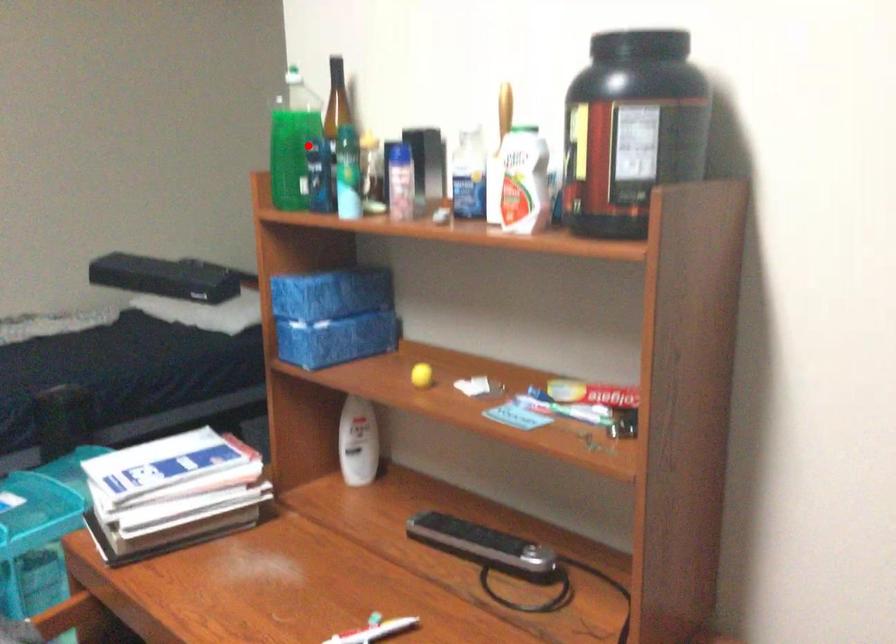
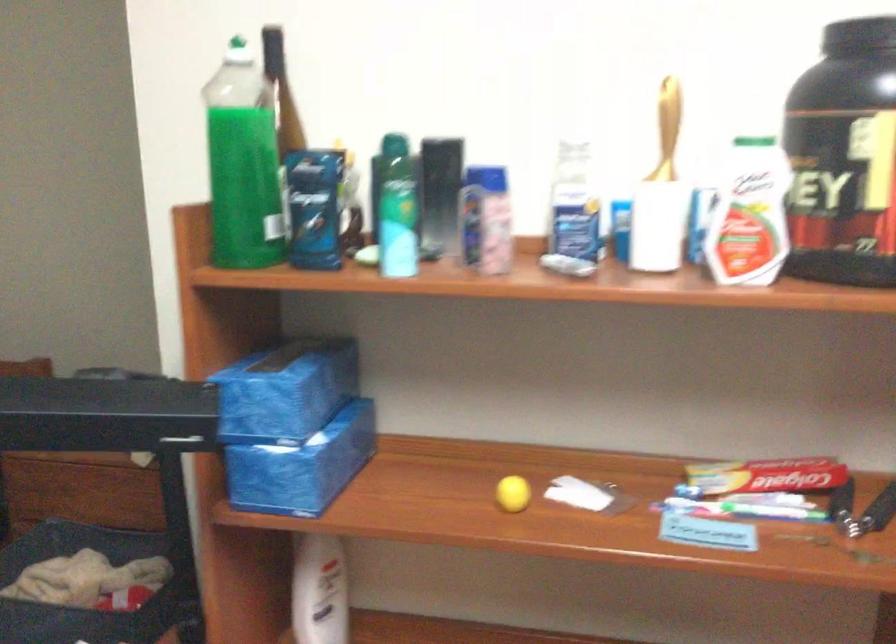
Question: A red point is marked in image1. In image2, is the corresponding 3D point closer to the camera or farther? Reply with the corresponding letter.

Choices:
 (A) The corresponding 3D point is closer.
 (B) The corresponding 3D point is farther.

Answer: (A)